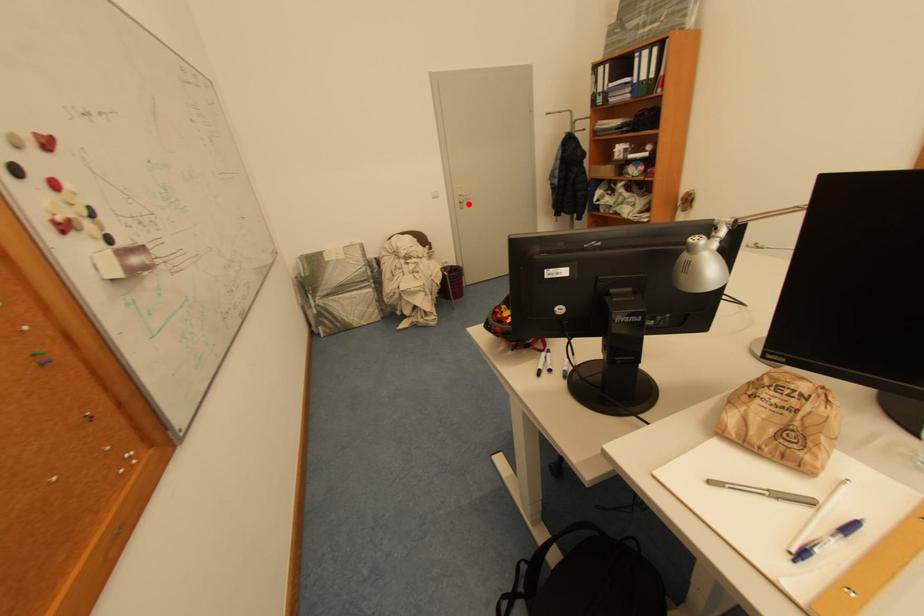
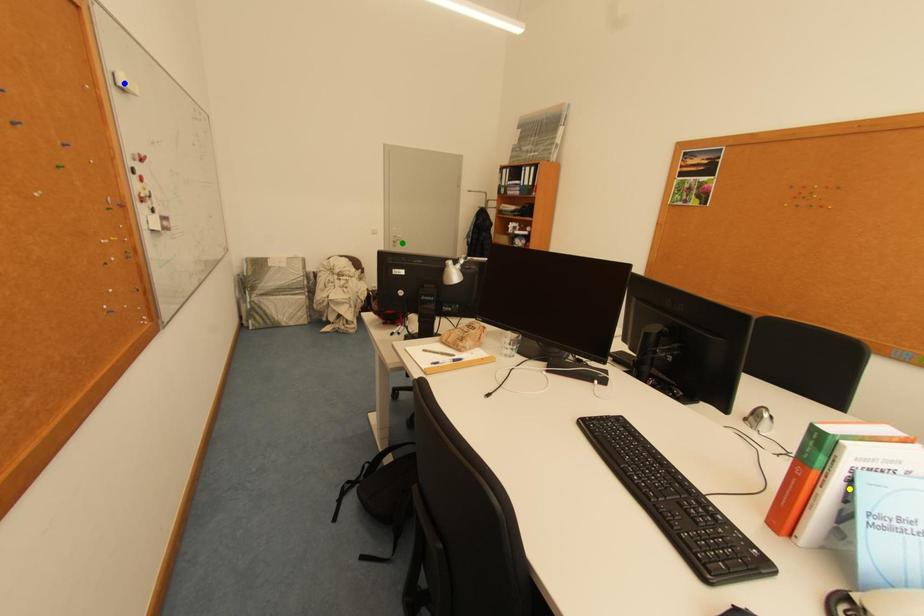
Question: I am providing you with two images of the same scene from different viewpoints. A red point is marked on the first image. You are given multiple points on the second image. Can you choose the point in image 2 that corresponds to the point in image 1?

Choices:
 (A) yellow point
 (B) green point
 (C) blue point

Answer: (B)